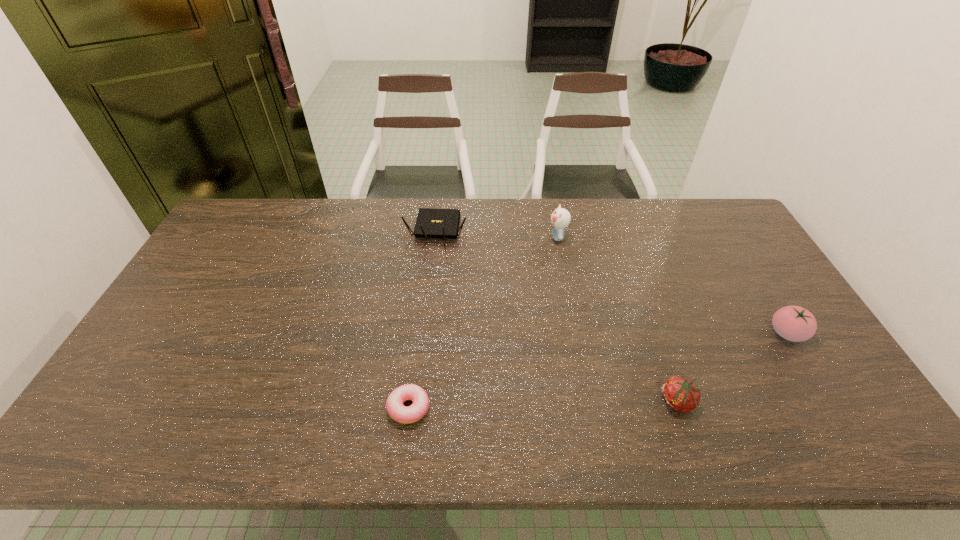
The width and height of the screenshot is (960, 540). Find the location of `free space that satisfies the following two spatial constraints: 1. on the front side of the second object from right to left; 2. on the left side of the router`. free space that satisfies the following two spatial constraints: 1. on the front side of the second object from right to left; 2. on the left side of the router is located at coordinates (417, 402).